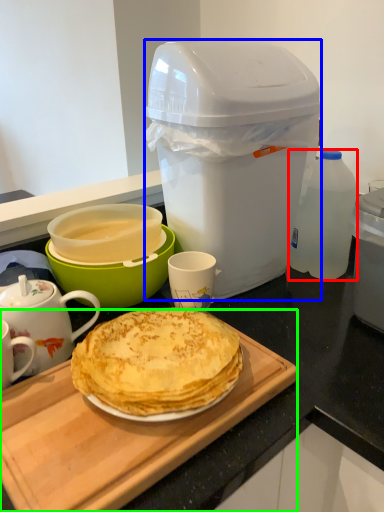
Question: Which is farther away from bottle (highlighted by a red box)? trash bin/can (highlighted by a blue box) or cutting board (highlighted by a green box)?

Choices:
 (A) trash bin/can
 (B) cutting board

Answer: (B)